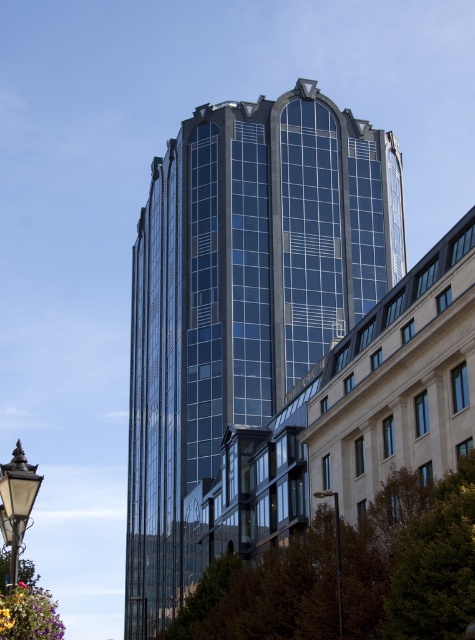
Question: Is glassy blue skyscraper at center to the right of black glass lamp post at lower right from the viewer's perspective?

Choices:
 (A) yes
 (B) no

Answer: (B)

Question: Does black glass lamp post at lower left appear under black glass lamp post at lower right?

Choices:
 (A) no
 (B) yes

Answer: (A)

Question: Does glassy blue skyscraper at center have a larger size compared to black glass lamp post at lower left?

Choices:
 (A) yes
 (B) no

Answer: (A)

Question: Estimate the real-world distances between objects in this image. Which object is farther from the glassy blue skyscraper at center?

Choices:
 (A) black glass lamp post at lower left
 (B) black glass lamp post at lower right

Answer: (A)

Question: Which object is closer to the camera taking this photo?

Choices:
 (A) glassy blue skyscraper at center
 (B) black glass lamp post at lower right

Answer: (B)

Question: Which point is farther to the camera?

Choices:
 (A) (27, 515)
 (B) (367, 310)
 (C) (336, 502)

Answer: (B)